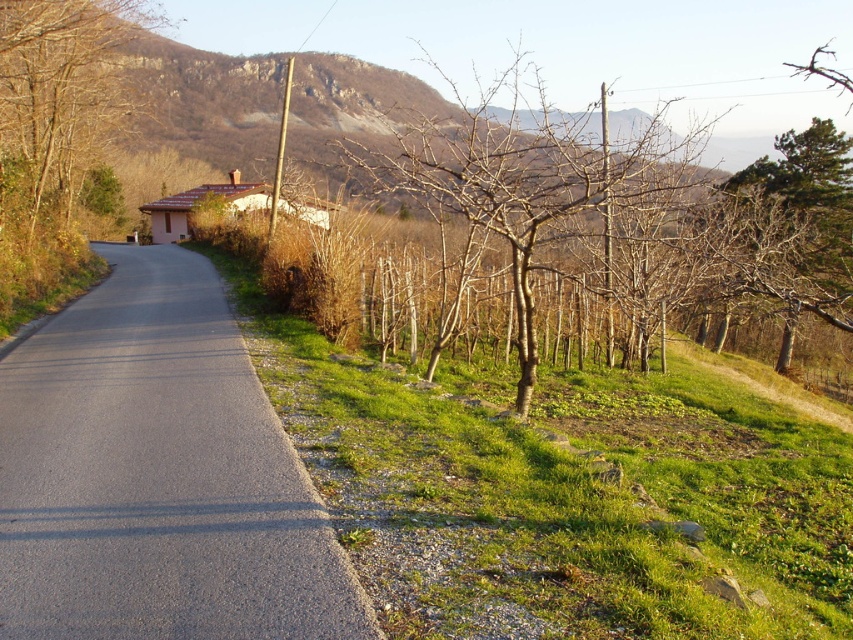
Question: Can you confirm if gray asphalt road at center is thinner than brown leafless tree at upper left?

Choices:
 (A) no
 (B) yes

Answer: (B)

Question: Which of the following is the farthest from the observer?

Choices:
 (A) (541, 230)
 (B) (241, 545)

Answer: (A)

Question: In this image, where is gray asphalt road at center located relative to bare wood tree at center?

Choices:
 (A) right
 (B) left

Answer: (B)

Question: Does gray asphalt road at center come behind brown leafless tree at upper left?

Choices:
 (A) no
 (B) yes

Answer: (A)

Question: Which is nearer to the brown leafless tree at upper left?

Choices:
 (A) bare wood tree at center
 (B) gray asphalt road at center

Answer: (B)

Question: Which of these objects is positioned closest to the bare wood tree at center?

Choices:
 (A) gray asphalt road at center
 (B) brown leafless tree at upper left

Answer: (B)